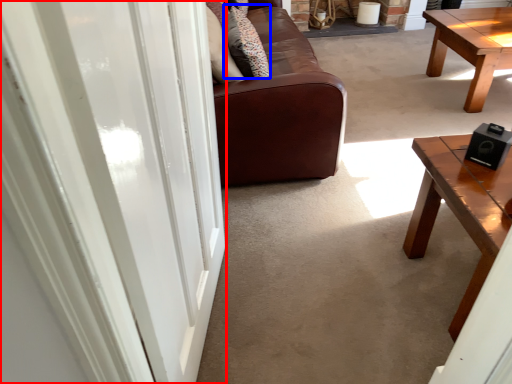
Question: Which object is further to the camera taking this photo, screen door (highlighted by a red box) or pillow (highlighted by a blue box)?

Choices:
 (A) screen door
 (B) pillow

Answer: (B)